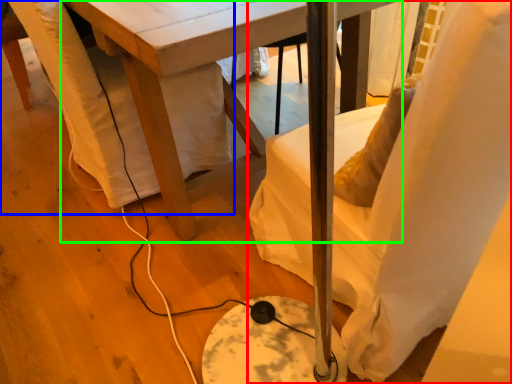
Question: Which is farther away from chair (highlighted by a red box)? swivel chair (highlighted by a blue box) or table (highlighted by a green box)?

Choices:
 (A) swivel chair
 (B) table

Answer: (A)